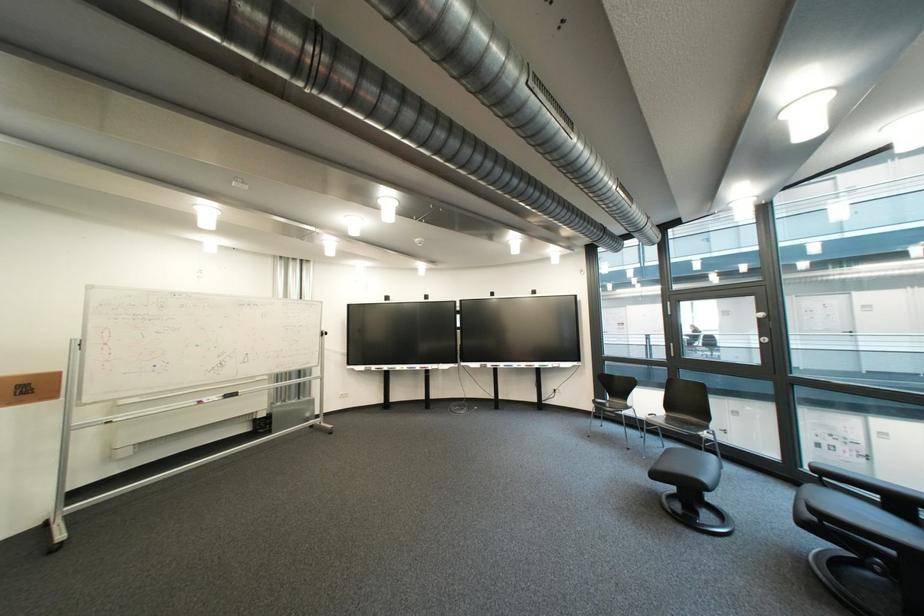
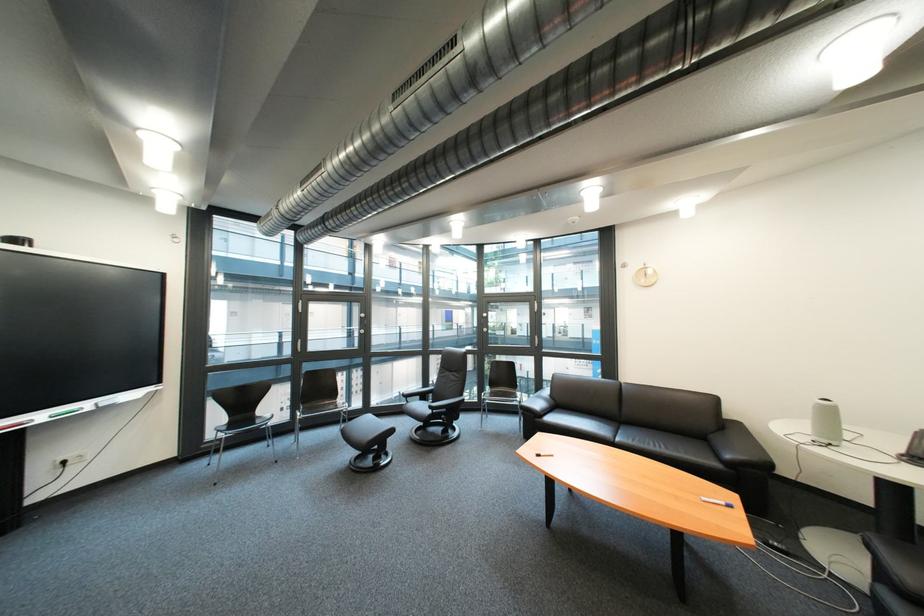
In the second image, find the point that corresponds to the point at 564,366 in the first image.

(101, 406)